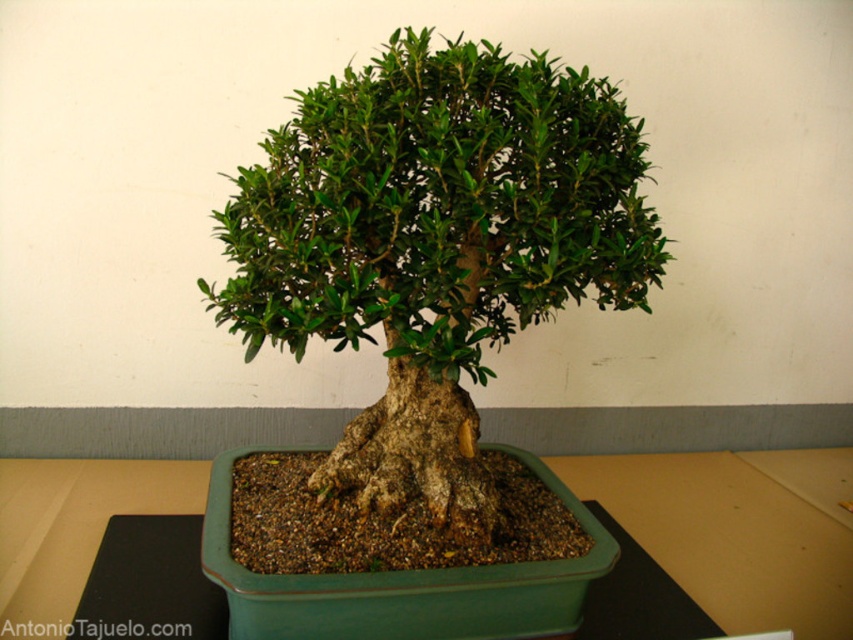
You are a gardener who wants to place a decorative stone next to the green matte bonsai tree at center and the green ceramic pot at center. Which object should the stone be placed closer to if you want it to be proportionally balanced with their sizes?

The green matte bonsai tree at center is larger in size than the green ceramic pot at center, so the decorative stone should be placed closer to the green ceramic pot at center to achieve proportional balance.

You are a gardener who wants to place a decorative statue next to the green ceramic pot at center. To ensure the statue doesn not block the view of the green matte bonsai tree at center, where should the statue be placed relative to the pot?

The green matte bonsai tree at center is taller than the green ceramic pot at center. Therefore, placing the statue behind the green ceramic pot at center would ensure it doesn not obstruct the view of the tree since the pot itself is shorter than the tree.

You are a gardener inspecting the bonsai tree in the image. You need to determine the position of the green matte bonsai tree at center relative to the green ceramic pot at center. Is the bonsai tree above or below the pot?

The green matte bonsai tree at center is above the green ceramic pot at center.